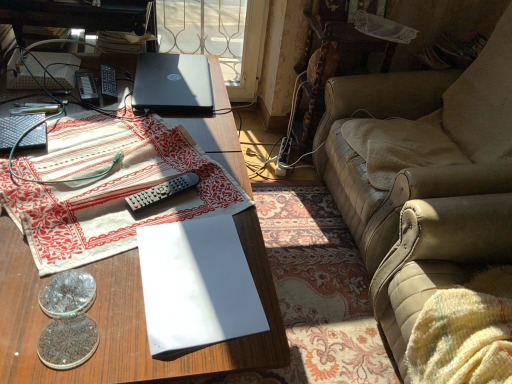
You are a GUI agent. You are given a task and a screenshot of the screen. Output one action in this format:
    pyautogui.click(x=<x>, y=<y>)
    Task: Click on the free point behind gray plastic remote at center, the 3th remote control viewed from the back
    The image size is (512, 384).
    Given the screenshot: What is the action you would take?
    pyautogui.click(x=176, y=154)